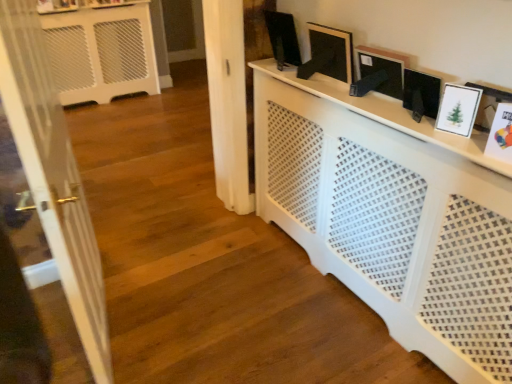
You are a GUI agent. You are given a task and a screenshot of the screen. Output one action in this format:
    pyautogui.click(x=<x>, y=<y>)
    Task: Click on the free space in front of white matte picture frame at upper right, which is the 3th picture frame in left-to-right order
    
    Given the screenshot: What is the action you would take?
    pyautogui.click(x=448, y=137)